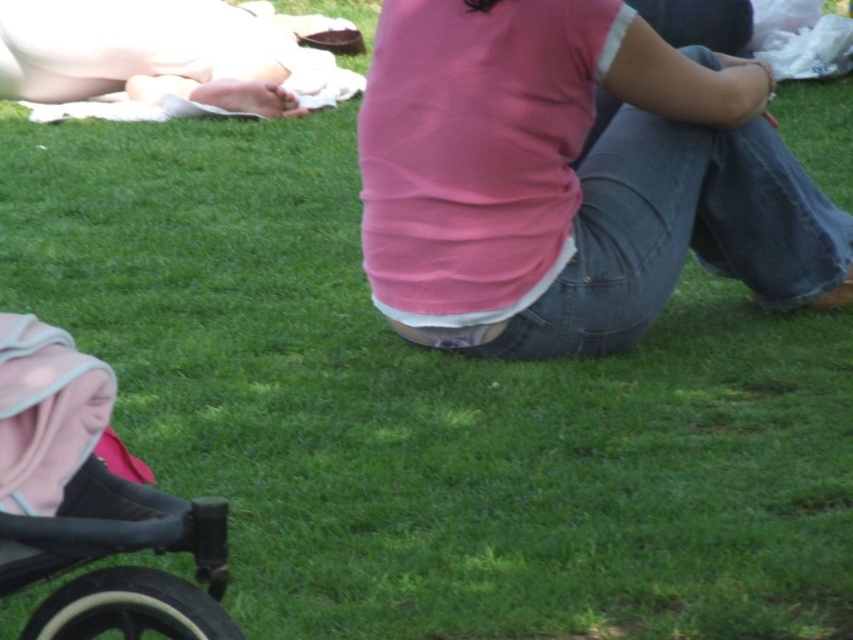
Between black rubber baby carriage at lower left and matte pink shirt at upper center, which one has more height?

With more height is matte pink shirt at upper center.

Which is behind, point (32, 627) or point (13, 96)?

Positioned behind is point (13, 96).

Where is `black rubber baby carriage at lower left`? black rubber baby carriage at lower left is located at coordinates (90, 504).

Locate an element on the screen. The height and width of the screenshot is (640, 853). black rubber baby carriage at lower left is located at coordinates (90, 504).

Is point (473, 289) behind point (288, 70)?

No, (473, 289) is closer to viewer.

Does pink cotton shirt at center have a greater height compared to matte pink shirt at upper center?

Yes, pink cotton shirt at center is taller than matte pink shirt at upper center.

Does point (527, 179) come farther from viewer compared to point (221, 19)?

No, (527, 179) is closer to viewer.

Identify the location of pink cotton shirt at center. (572, 177).

Does pink cotton shirt at center appear over black rubber baby carriage at lower left?

Yes, pink cotton shirt at center is above black rubber baby carriage at lower left.

Is pink cotton shirt at center further to the viewer compared to black rubber baby carriage at lower left?

Yes.

Where is `pink cotton shirt at center`? Image resolution: width=853 pixels, height=640 pixels. pink cotton shirt at center is located at coordinates (572, 177).

The height and width of the screenshot is (640, 853). Identify the location of pink cotton shirt at center. (572, 177).